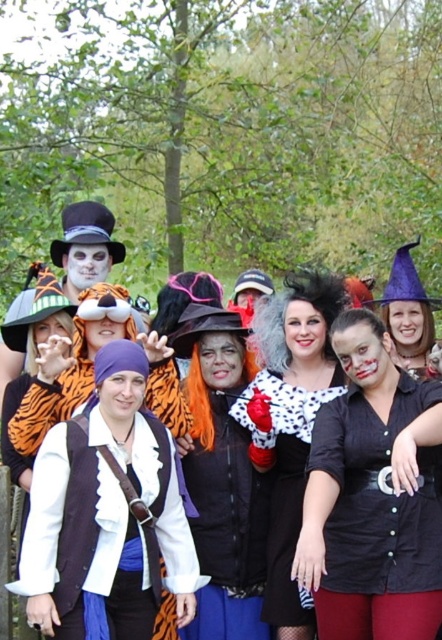
You are organizing a costume parade and need to arrange participants so that the larger costume is in front to block the smaller one from being seen. Given the matte black shirt at center and the orange tiger costume at center, which costume should be placed in front?

The matte black shirt at center is bigger than the orange tiger costume at center, so the matte black shirt at center should be placed in front to block the smaller orange tiger costume at center from being seen.